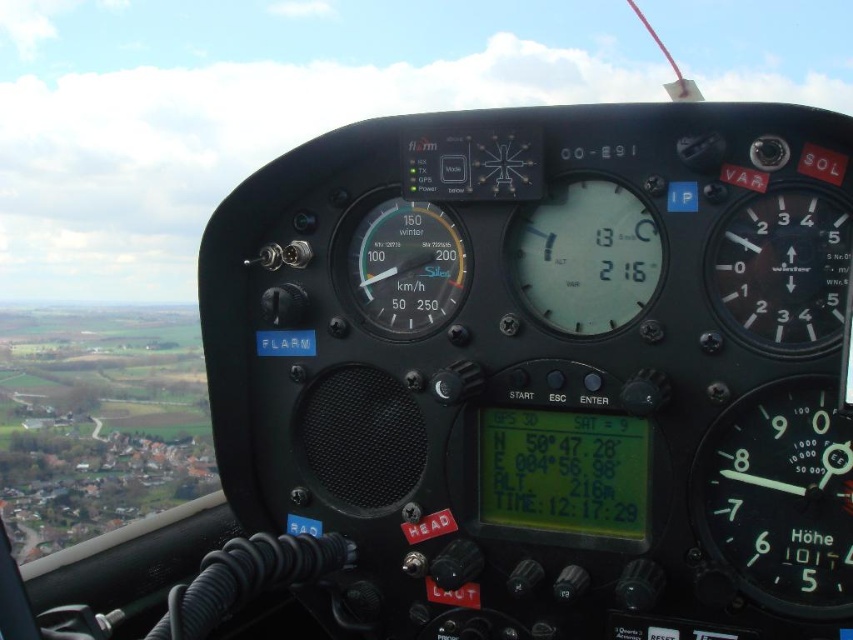
Based on the cockpit view, where exactly is the white illuminated needle at right located in terms of coordinates?

The white illuminated needle at right is located at coordinates point (780, 497).

You are a pilot checking the cockpit instruments. You need to locate the white illuminated needle at right. Where exactly is it positioned on the dashboard?

The white illuminated needle at right is positioned at point (780, 497) on the dashboard.